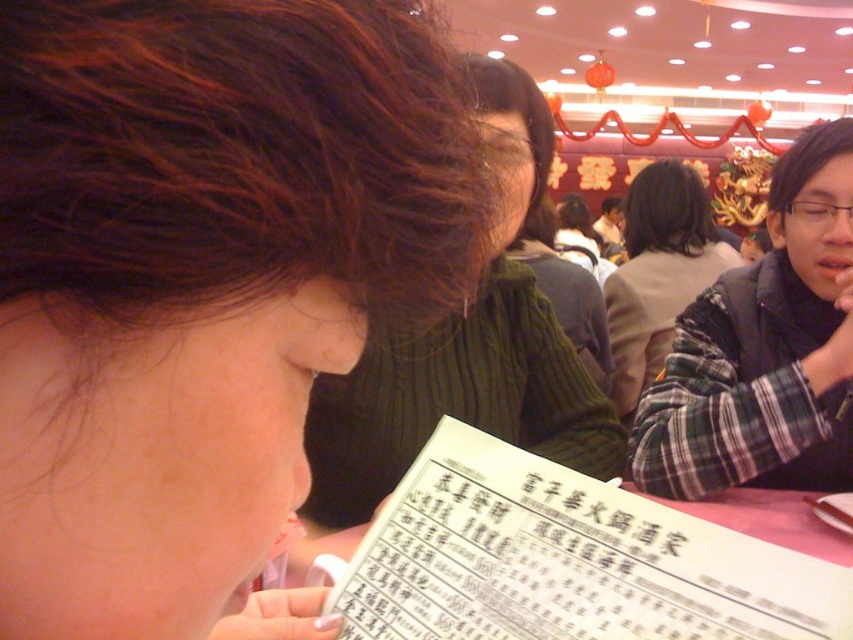
Question: Estimate the real-world distances between objects in this image. Which object is farther from the brown matte hair at upper left?

Choices:
 (A) green knitted sweater at center
 (B) white paper menu at center

Answer: (A)

Question: Estimate the real-world distances between objects in this image. Which object is closer to the brown matte hair at upper left?

Choices:
 (A) white paper menu at center
 (B) green knitted sweater at center

Answer: (A)

Question: Is brown matte hair at upper left above green knitted sweater at center?

Choices:
 (A) yes
 (B) no

Answer: (B)

Question: Is brown matte hair at upper left in front of white paper menu at center?

Choices:
 (A) yes
 (B) no

Answer: (A)

Question: Which of the following is the farthest from the observer?

Choices:
 (A) (787, 627)
 (B) (187, 284)

Answer: (A)

Question: In this image, where is brown matte hair at upper left located relative to green knitted sweater at center?

Choices:
 (A) right
 (B) left

Answer: (B)